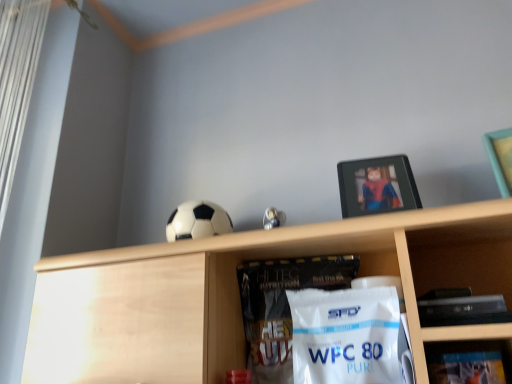
Question: Considering their positions, is metallic silver frame at upper right, which is the 1th shelf from back to front, located in front of or behind black matte soccer ball at upper center?

Choices:
 (A) front
 (B) behind

Answer: (A)

Question: Is point (505, 342) positioned closer to the camera than point (193, 213)?

Choices:
 (A) closer
 (B) farther

Answer: (A)

Question: Which object is positioned closest to the metallic silver picture frame at upper center?

Choices:
 (A) black matte soccer ball at upper center
 (B) metallic silver frame at upper right, which ranks as the 1th shelf in right-to-left order
 (C) wooden shelf at upper center, which is counted as the 2th shelf, starting from the back

Answer: (C)

Question: Which of these objects is positioned farthest from the wooden shelf at upper center, which is the first shelf in front-to-back order?

Choices:
 (A) black matte soccer ball at upper center
 (B) metallic silver picture frame at upper center
 (C) metallic silver frame at upper right, which ranks as the 1th shelf in right-to-left order

Answer: (C)